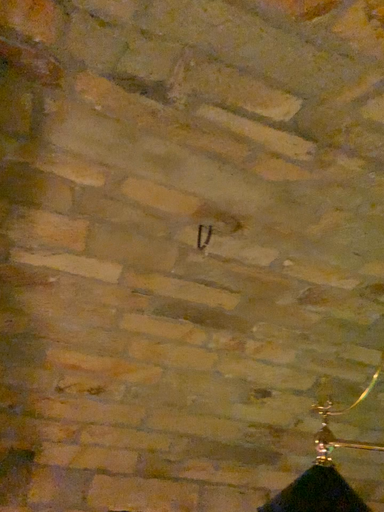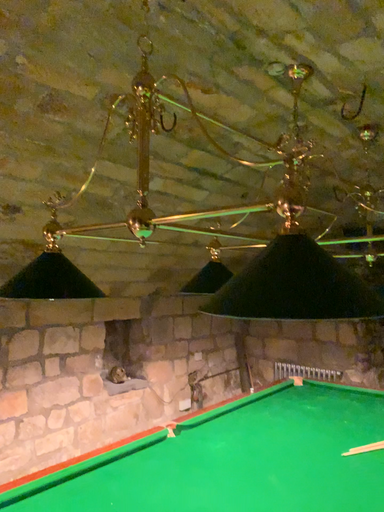
Question: How did the camera likely rotate when shooting the video?

Choices:
 (A) rotated downward
 (B) rotated upward

Answer: (A)